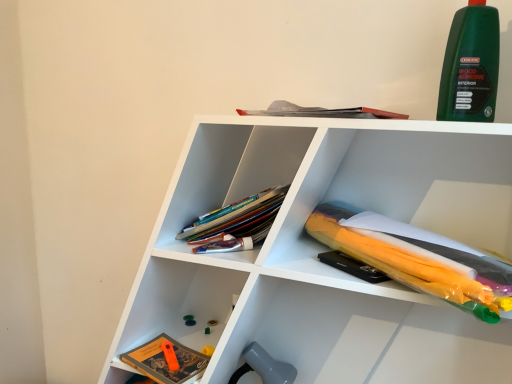
Question: Based on their sizes in the image, would you say green plastic toy at lower center is bigger or smaller than translucent plastic umbrella at lower right, the second book from the bottom?

Choices:
 (A) small
 (B) big

Answer: (A)

Question: Is point (189, 319) closer or farther from the camera than point (481, 309)?

Choices:
 (A) farther
 (B) closer

Answer: (A)

Question: Which object is the farthest from the white plastic umbrella at upper right?

Choices:
 (A) translucent plastic umbrella at lower right, which is counted as the first book, starting from the right
 (B) hardcover book at lower left, the 1th book viewed from the left
 (C) green plastic toy at lower center
 (D) matte plastic books at center
 (E) green matte wood adhesive at upper right

Answer: (C)

Question: Based on their relative distances, which object is farther from the hardcover book at lower left, which is counted as the 1th book, starting from the bottom?

Choices:
 (A) translucent plastic umbrella at lower right, which is counted as the first book, starting from the right
 (B) white plastic umbrella at upper right
 (C) matte plastic books at center
 (D) green matte wood adhesive at upper right
 (E) green plastic toy at lower center

Answer: (D)